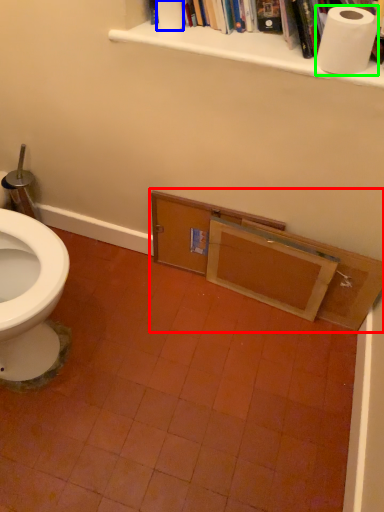
Question: Which object is positioned closest to vanity (highlighted by a red box)? Select from toilet paper (highlighted by a blue box) and toilet paper (highlighted by a green box).

Choices:
 (A) toilet paper
 (B) toilet paper

Answer: (B)